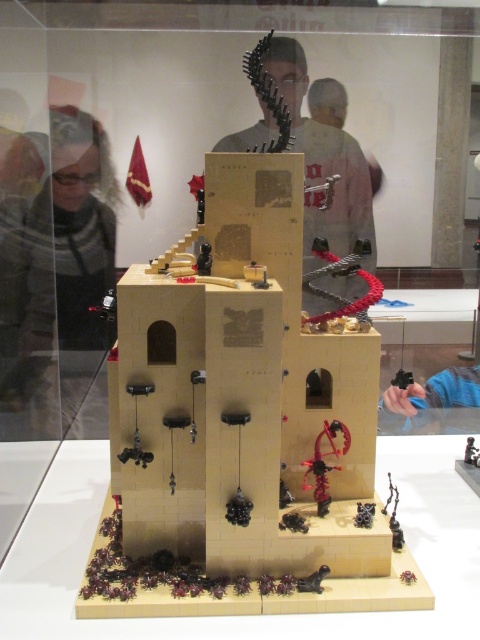
Measure the distance between point (63, 317) and camera.

Point (63, 317) is 9.15 feet away from camera.

Between matte gray sweater at left and matte black sculpture at center, which one has more height?

matte gray sweater at left

Image resolution: width=480 pixels, height=640 pixels. What do you see at coordinates (58, 285) in the screenshot?
I see `matte gray sweater at left` at bounding box center [58, 285].

Find the location of a particular element. matte gray sweater at left is located at coordinates (58, 285).